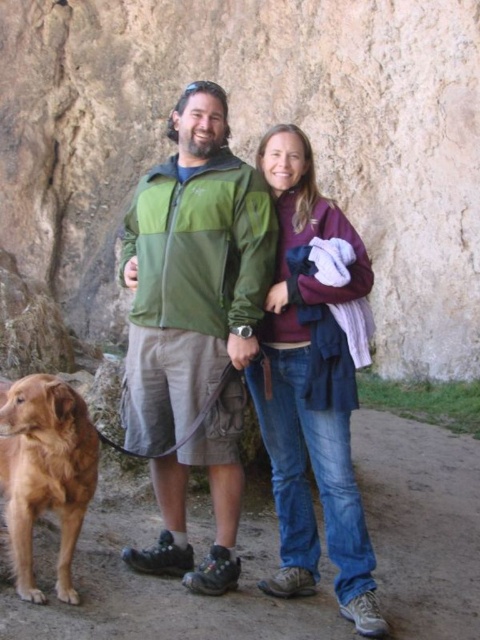
Does green fabric jacket at center appear on the left side of golden fur dog at lower left?

In fact, green fabric jacket at center is to the right of golden fur dog at lower left.

Who is shorter, green fabric jacket at center or golden fur dog at lower left?

golden fur dog at lower left

Is point (220, 220) less distant than point (92, 451)?

No, it is not.

Locate an element on the screen. This screenshot has height=640, width=480. green fabric jacket at center is located at coordinates coord(193,324).

Between point (140, 316) and point (274, 337), which one is positioned behind?

The point (274, 337) is more distant.

How far apart are green fabric jacket at center and purple fleece jacket at center?

A distance of 6.27 feet exists between green fabric jacket at center and purple fleece jacket at center.

At what (x,y) coordinates should I click in order to perform the action: click on green fabric jacket at center. Please return your answer as a coordinate pair (x, y). The image size is (480, 640). Looking at the image, I should click on [x=193, y=324].

Can you confirm if purple fleece jacket at center is wider than golden fur dog at lower left?

Yes, purple fleece jacket at center is wider than golden fur dog at lower left.

Can you confirm if purple fleece jacket at center is positioned to the left of golden fur dog at lower left?

In fact, purple fleece jacket at center is to the right of golden fur dog at lower left.

Is point (348, 589) in front of point (15, 477)?

No, it is not.

At what (x,y) coordinates should I click in order to perform the action: click on purple fleece jacket at center. Please return your answer as a coordinate pair (x, y). Looking at the image, I should click on (313, 381).